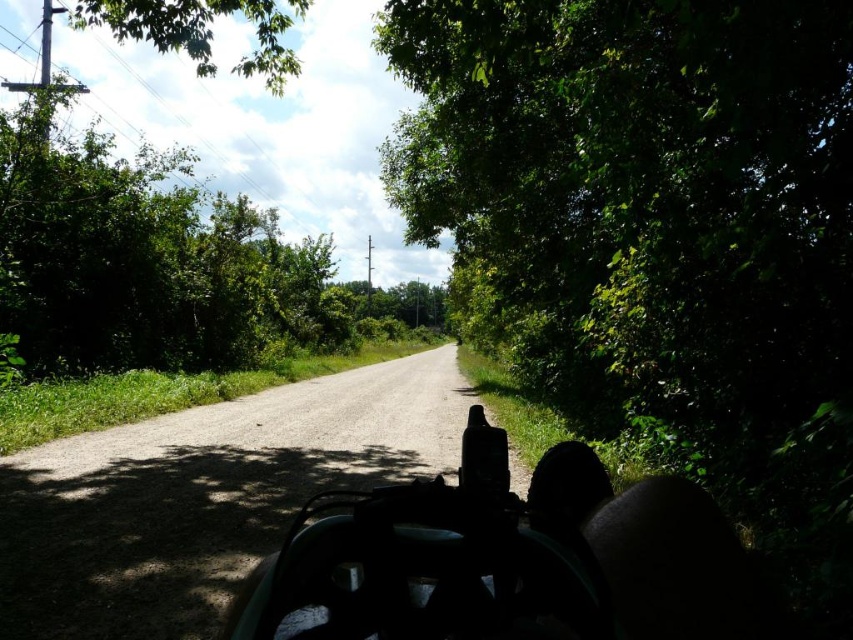
Question: Which point is closer to the camera taking this photo?

Choices:
 (A) (61, 166)
 (B) (477, 456)

Answer: (B)

Question: Is green plastic baby carriage at center behind green leafy tree at upper center?

Choices:
 (A) no
 (B) yes

Answer: (A)

Question: Does green plastic baby carriage at center have a larger size compared to green leafy tree at upper center?

Choices:
 (A) yes
 (B) no

Answer: (B)

Question: Is green plastic baby carriage at center thinner than green leafy tree at upper center?

Choices:
 (A) no
 (B) yes

Answer: (B)

Question: Among these points, which one is farthest from the camera?

Choices:
 (A) (379, 493)
 (B) (47, 160)

Answer: (B)